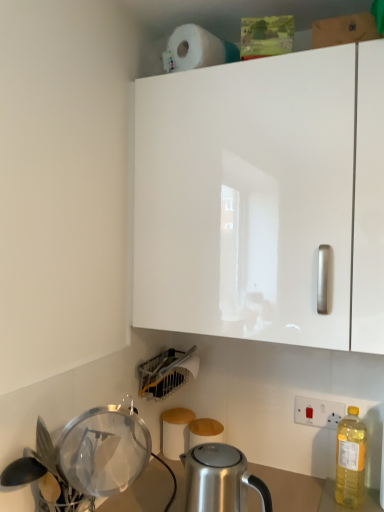
Question: From the image's perspective, is white matte toilet paper at lower center positioned above or below transparent plastic strainer at lower left, which appears as the 1th appliance when viewed from the front?

Choices:
 (A) above
 (B) below

Answer: (B)

Question: From a real-world perspective, is white matte toilet paper at lower center positioned above or below transparent plastic strainer at lower left, the 2th appliance positioned from the back?

Choices:
 (A) above
 (B) below

Answer: (B)

Question: Which object is positioned closest to the matte plastic dish rack at lower center, which ranks as the first appliance in back-to-front order?

Choices:
 (A) white matte toilet paper at lower center
 (B) white glossy cabinet at upper center
 (C) white matte paper towel at upper center
 (D) satin silver kettle at lower center
 (E) transparent plastic strainer at lower left, the 2th appliance positioned from the back

Answer: (A)

Question: Based on their relative distances, which object is nearer to the satin silver kettle at lower center?

Choices:
 (A) white glossy cabinet at upper center
 (B) white matte toilet paper at lower center
 (C) white matte paper towel at upper center
 (D) matte plastic dish rack at lower center, which ranks as the first appliance in back-to-front order
 (E) yellow translucent bottle at right

Answer: (B)